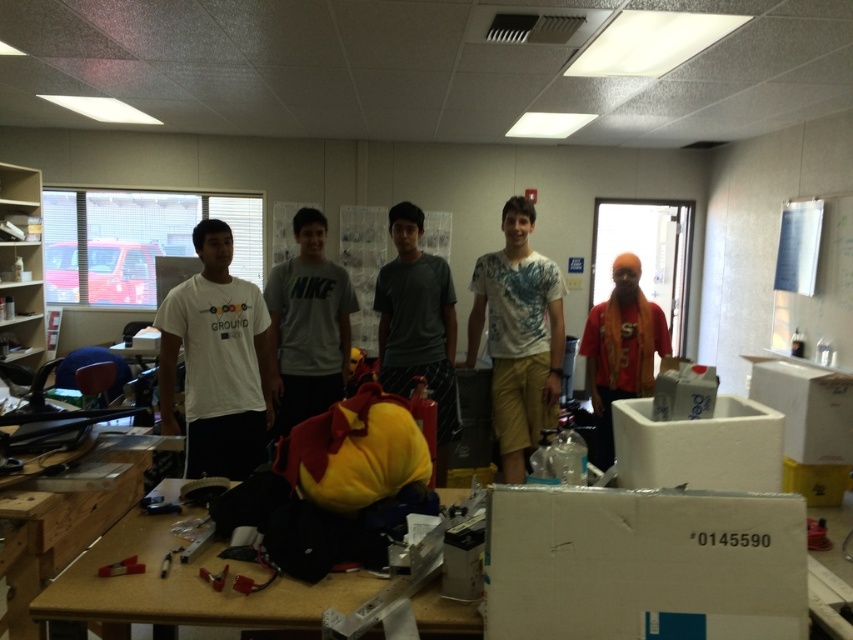
Question: Which object is the closest to the orange fabric shirt at right?

Choices:
 (A) white printed t-shirt at center
 (B) brown wood table at lower left

Answer: (A)

Question: Is orange fabric shirt at right to the left of metallic silver tool at lower left from the viewer's perspective?

Choices:
 (A) yes
 (B) no

Answer: (B)

Question: Which point is closer to the camera?

Choices:
 (A) gray cotton t-shirt at center
 (B) white printed t-shirt at center

Answer: (B)

Question: Does gray cotton t-shirt at center have a greater width compared to metallic silver tool at lower left?

Choices:
 (A) no
 (B) yes

Answer: (B)

Question: Which object is the closest to the metallic silver tool at lower left?

Choices:
 (A) orange fabric shirt at right
 (B) gray cotton shirt at center
 (C) metallic red screwdriver at lower left

Answer: (C)

Question: Does metallic red screwdriver at lower left have a smaller size compared to metallic silver tool at lower left?

Choices:
 (A) yes
 (B) no

Answer: (B)